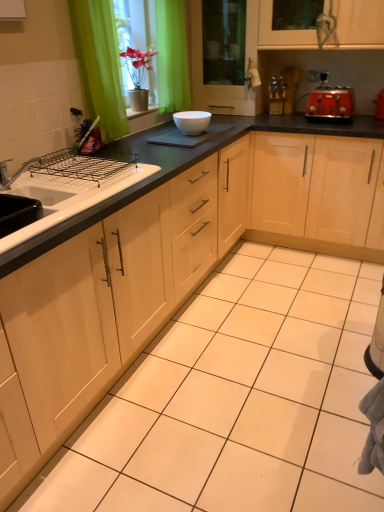
Question: From a real-world perspective, relative to green fabric curtain at upper left, is matte wood cabinet at center, which appears as the 2th cabinetry when viewed from the right, vertically above or below?

Choices:
 (A) above
 (B) below

Answer: (B)

Question: Looking at the image, does matte wood cabinet at center, which appears as the 2th cabinetry when viewed from the right, seem bigger or smaller compared to green fabric curtain at upper left?

Choices:
 (A) small
 (B) big

Answer: (B)

Question: Estimate the real-world distances between objects in this image. Which object is closer to the red matte toaster at upper right?

Choices:
 (A) white glossy sink at left
 (B) matte wood cabinet at center, the 1th cabinetry viewed from the left
 (C) green fabric curtain at upper left
 (D) light wood cabinet at center, which ranks as the 1th cabinetry in right-to-left order
 (E) white glossy bowl at center

Answer: (D)

Question: Which of these objects is positioned closest to the green fabric curtain at upper left?

Choices:
 (A) matte wood cabinet at center, the 1th cabinetry viewed from the left
 (B) white glossy bowl at center
 (C) transparent glass screen door at upper center
 (D) light wood cabinet at center, which ranks as the 1th cabinetry in right-to-left order
 (E) red matte toaster at upper right

Answer: (B)